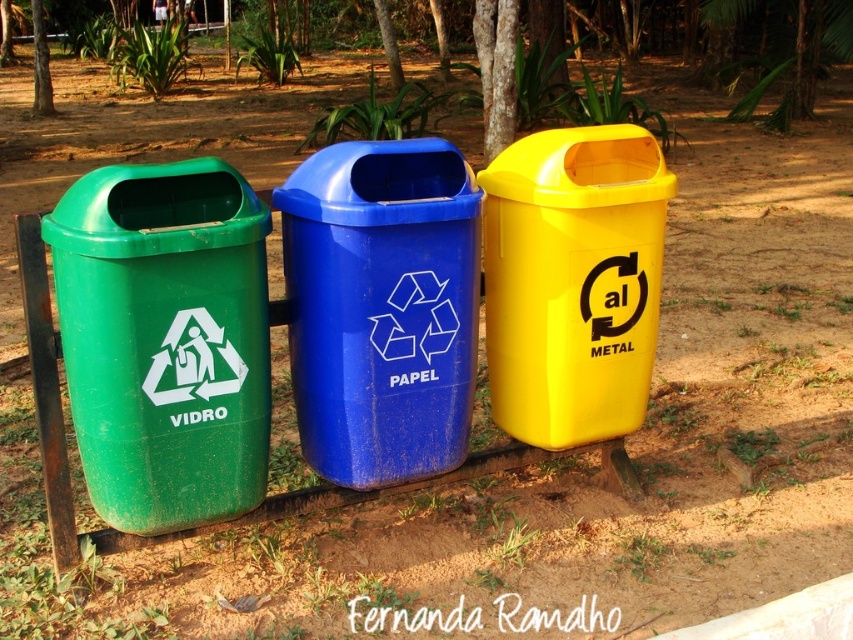
You are standing at the origin point of the coordinate system in the park. There is a green plastic recycling bin labeled VIDRO at the left and a blue recycling bin labeled PAPEL at the right. A yellow recycling bin labeled METAL is in the center. A small sticker is placed at coordinate point (165,339). Which recycling bin is the sticker located on?

The sticker is located on the green plastic recycling bin labeled VIDRO at the left because the point (165,339) is on the green plastic recycling bin at left according to the objects description.

You are standing at the point marked by the coordinate point at point [192,340]. You want to place a glass bottle into the correct recycling bin. Which bin should you walk towards, and will you need to walk more than 7 feet to reach it?

The green bin labeled VIDRO is the correct bin for the glass bottle. Since the distance between the point and the green bin is 7.44 feet, you will need to walk more than 7 feet to reach it.

You are standing at the park and want to place a recyclable item into the correct bin. You have a glass bottle and need to find the green bin labeled VIDRO. However, you can only see two points in your field of view corresponding to the bins. The first point at coordinates point (241, 364) is in front of point (653, 305). Which point corresponds to the green bin labeled VIDRO?

The green bin labeled VIDRO is at point (241, 364) because it is in front of the other point, indicating it is closer to you.